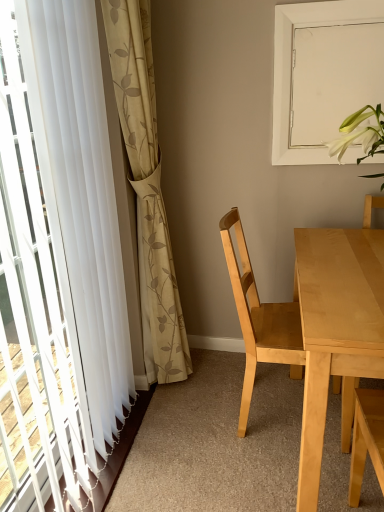
This screenshot has width=384, height=512. Find the location of `free location in front of beige floral fabric curtain at left, which appears as the first curtain when viewed from the right`. free location in front of beige floral fabric curtain at left, which appears as the first curtain when viewed from the right is located at coordinates (183, 443).